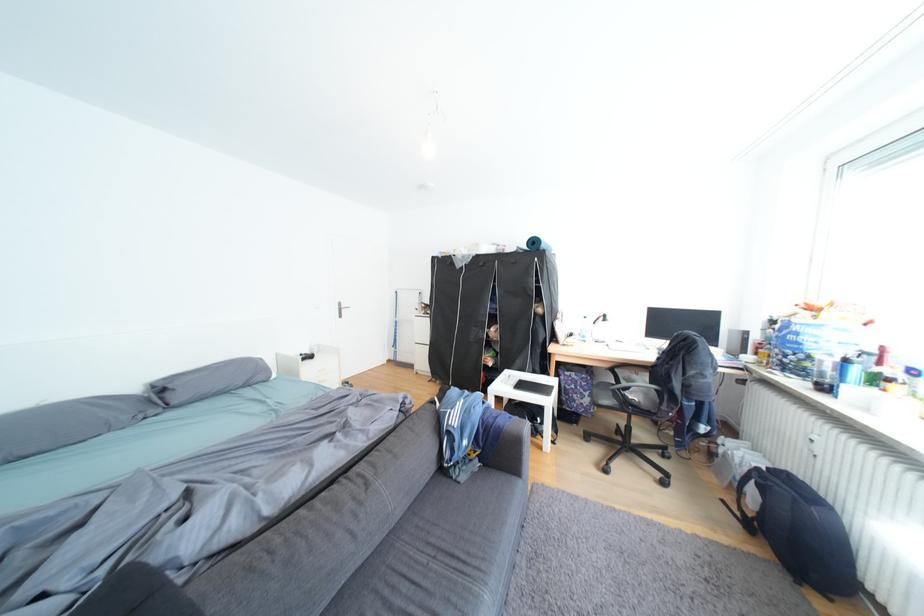
The height and width of the screenshot is (616, 924). What do you see at coordinates (420, 329) in the screenshot?
I see `the white cabinet drawer` at bounding box center [420, 329].